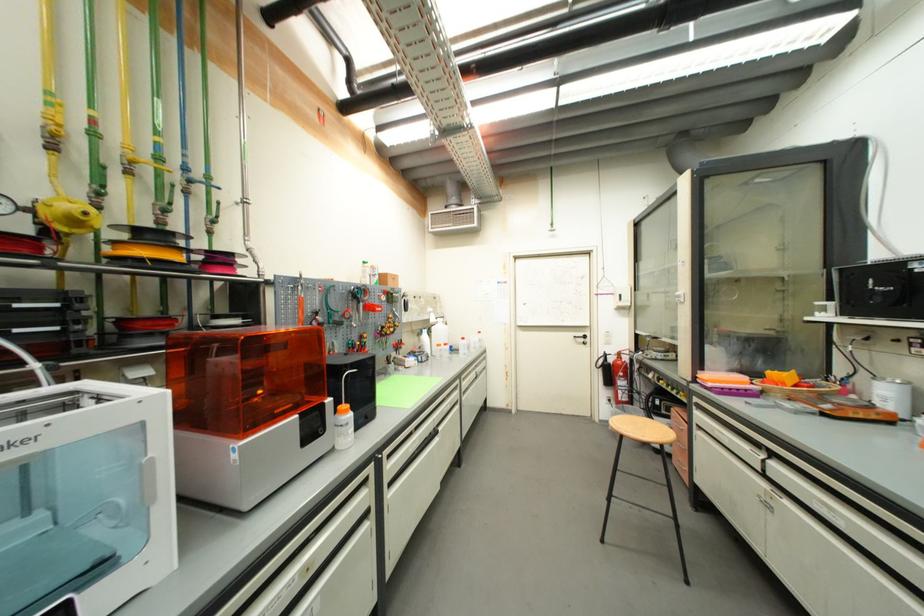
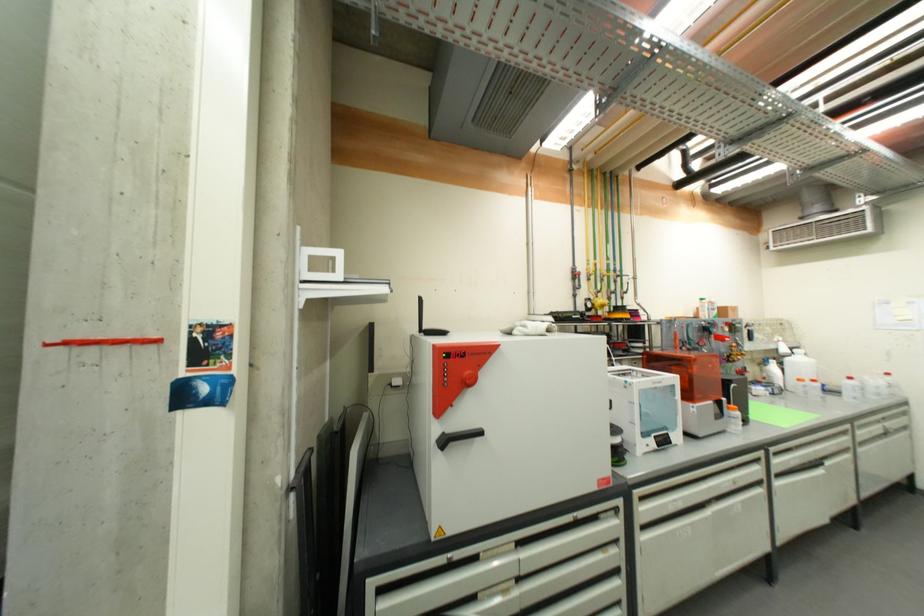
The point at [468,392] is marked in the first image. Where is the corresponding point in the second image?

(864, 442)